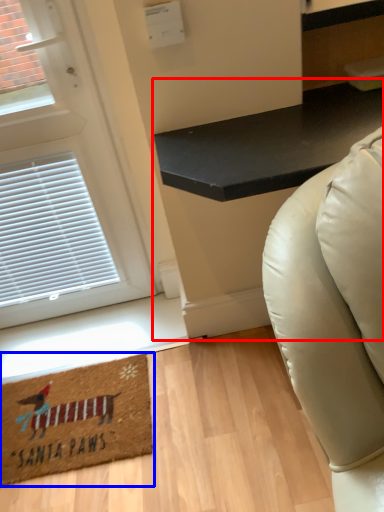
Question: Among these objects, which one is farthest to the camera, table (highlighted by a red box) or mat (highlighted by a blue box)?

Choices:
 (A) table
 (B) mat

Answer: (B)